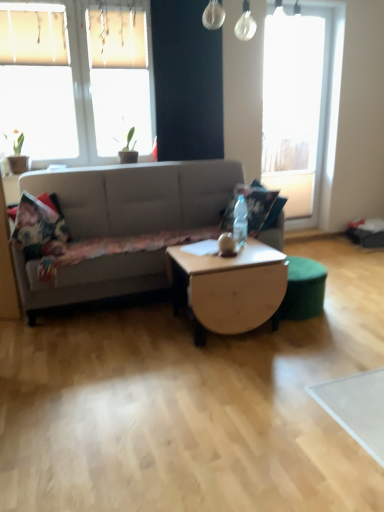
Question: Looking at their shapes, would you say wooden coffee table at center is wider or thinner than fluffy floral pillow at center, the 2th pillow from the left?

Choices:
 (A) thin
 (B) wide

Answer: (B)

Question: In the image, is wooden coffee table at center positioned in front of or behind fluffy floral pillow at center, the 2th pillow from the left?

Choices:
 (A) front
 (B) behind

Answer: (A)

Question: Considering the real-world distances, which object is closest to the fluffy floral pillow at center, which ranks as the 1th pillow in right-to-left order?

Choices:
 (A) translucent glass bottle at center
 (B) wooden coffee table at center
 (C) matte gray studio couch at center
 (D) white fabric window at upper left, which is the first window from left to right
 (E) fluffy floral pillow at left, the 2th pillow from the right

Answer: (A)

Question: Which object is positioned closest to the transparent glass window at upper right, which is the 1th window in back-to-front order?

Choices:
 (A) fluffy floral pillow at center, which ranks as the 1th pillow in right-to-left order
 (B) fluffy floral pillow at left, the 2th pillow from the right
 (C) wooden coffee table at center
 (D) matte gray studio couch at center
 (E) white fabric window at upper left, which ranks as the first window in front-to-back order

Answer: (A)